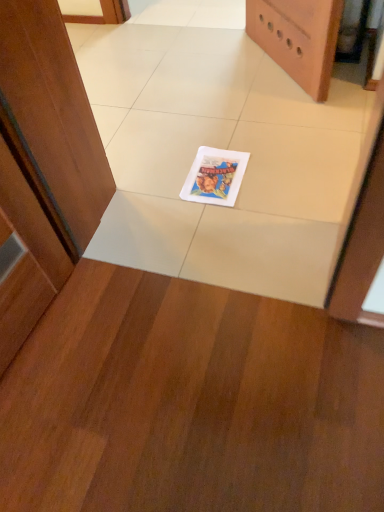
Measure the distance between matte white comic book at center and camera.

matte white comic book at center is 1.51 meters away from camera.

Find the location of a particular element. matte white comic book at center is located at coordinates (215, 176).

Describe the element at coordinates (215, 176) in the screenshot. I see `matte white comic book at center` at that location.

What is the approximate height of matte white comic book at center?

1.00 centimeters.

Describe the element at coordinates (218, 147) in the screenshot. I see `white glossy tile at center` at that location.

Image resolution: width=384 pixels, height=512 pixels. I want to click on white glossy tile at center, so click(x=218, y=147).

Where is `matte white comic book at center`? matte white comic book at center is located at coordinates (215, 176).

Can you confirm if matte white comic book at center is positioned to the right of white glossy tile at center?

Yes.

Is the position of matte white comic book at center more distant than that of white glossy tile at center?

Yes, matte white comic book at center is further from the viewer.

Does point (229, 190) lie in front of point (301, 149)?

Yes.

From the image's perspective, does matte white comic book at center appear lower than white glossy tile at center?

Indeed, from the image's perspective, matte white comic book at center is shown beneath white glossy tile at center.

From a real-world perspective, which object rests below the other?

white glossy tile at center, from a real-world perspective.

In the scene shown: Considering the relative sizes of matte white comic book at center and white glossy tile at center in the image provided, is matte white comic book at center thinner than white glossy tile at center?

Correct, the width of matte white comic book at center is less than that of white glossy tile at center.

Which of these two, matte white comic book at center or white glossy tile at center, stands shorter?

With less height is matte white comic book at center.

Between matte white comic book at center and white glossy tile at center, which one has smaller size?

With smaller size is matte white comic book at center.

Is white glossy tile at center inside matte white comic book at center?

No, white glossy tile at center is not inside matte white comic book at center.

Is matte white comic book at center directly adjacent to white glossy tile at center?

matte white comic book at center and white glossy tile at center are clearly separated.

Based on the photo, is matte white comic book at center looking in the opposite direction of white glossy tile at center?

Absolutely, matte white comic book at center is directed away from white glossy tile at center.

How different are the orientations of matte white comic book at center and white glossy tile at center in degrees?

The facing directions of matte white comic book at center and white glossy tile at center are 91.8 degrees apart.

Image resolution: width=384 pixels, height=512 pixels. What are the coordinates of `comic book that appears below the white glossy tile at center (from the image's perspective)` in the screenshot? It's located at (215, 176).

Is white glossy tile at center to the left or to the right of matte white comic book at center in the image?

white glossy tile at center is to the left of matte white comic book at center.

Considering their positions, is white glossy tile at center located in front of or behind matte white comic book at center?

Visually, white glossy tile at center is located in front of matte white comic book at center.

Is point (121, 74) closer to viewer compared to point (214, 203)?

That is False.

From the image's perspective, is white glossy tile at center under matte white comic book at center?

Incorrect, from the image's perspective, white glossy tile at center is higher than matte white comic book at center.

From a real-world perspective, between white glossy tile at center and matte white comic book at center, who is vertically lower?

From a 3D spatial view, white glossy tile at center is below.

Can you confirm if white glossy tile at center is thinner than matte white comic book at center?

No.

Who is taller, white glossy tile at center or matte white comic book at center?

white glossy tile at center is taller.

Is white glossy tile at center smaller than matte white comic book at center?

No.

Is matte white comic book at center a part of white glossy tile at center?

Yes, matte white comic book at center is surrounded by white glossy tile at center.

Would you say white glossy tile at center is a long distance from matte white comic book at center?

No, white glossy tile at center is not far from matte white comic book at center.

Is white glossy tile at center oriented towards matte white comic book at center?

Yes, white glossy tile at center is turned towards matte white comic book at center.

Where is `comic book above the white glossy tile at center (from a real-world perspective)`? The image size is (384, 512). comic book above the white glossy tile at center (from a real-world perspective) is located at coordinates (215, 176).

This screenshot has width=384, height=512. In order to click on comic book located behind the white glossy tile at center in this screenshot , I will do `click(215, 176)`.

You are a GUI agent. You are given a task and a screenshot of the screen. Output one action in this format:
    pyautogui.click(x=<x>, y=<y>)
    Task: Click on the comic book above the white glossy tile at center (from a real-world perspective)
    This screenshot has width=384, height=512.
    Given the screenshot: What is the action you would take?
    pyautogui.click(x=215, y=176)